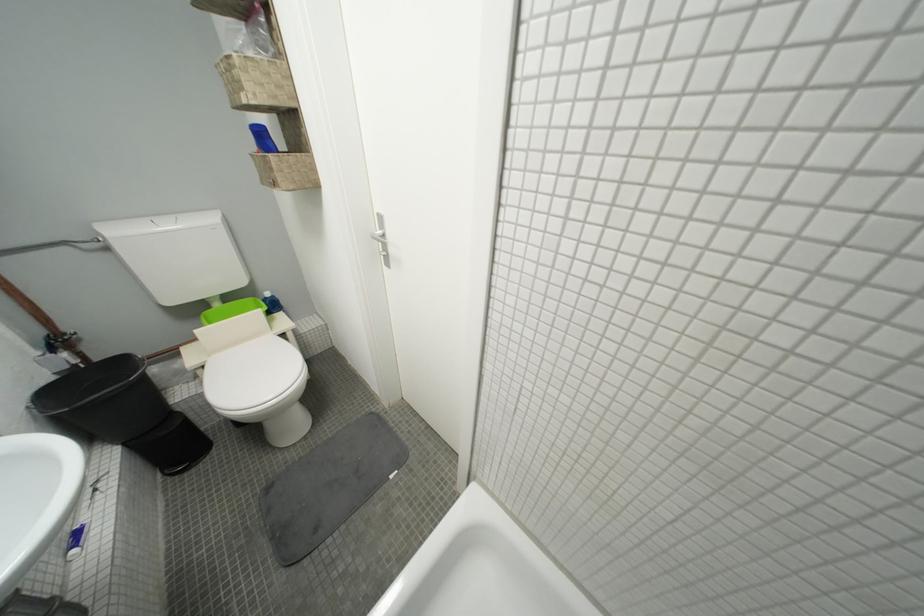
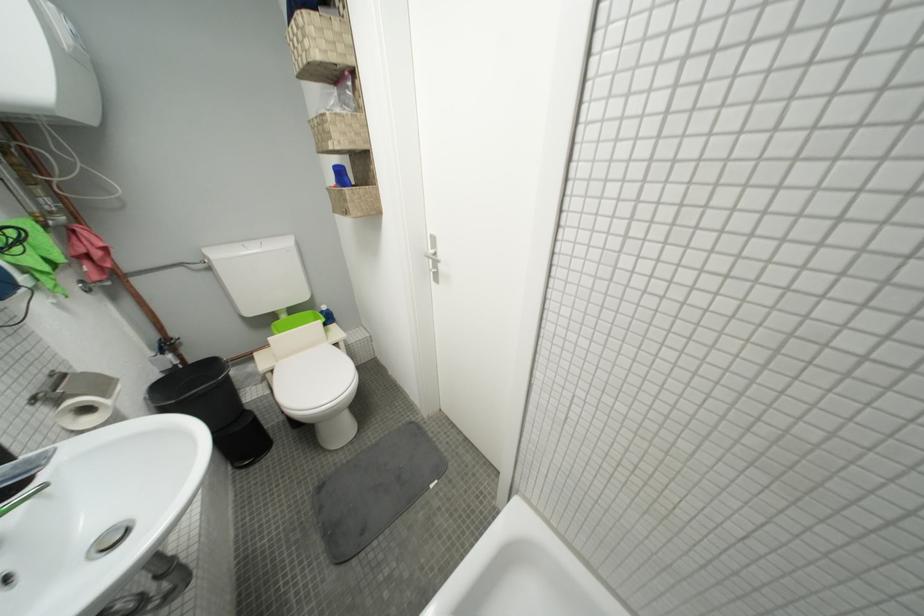
Where in the second image is the point corresponding to [259,55] from the first image?

(346, 113)